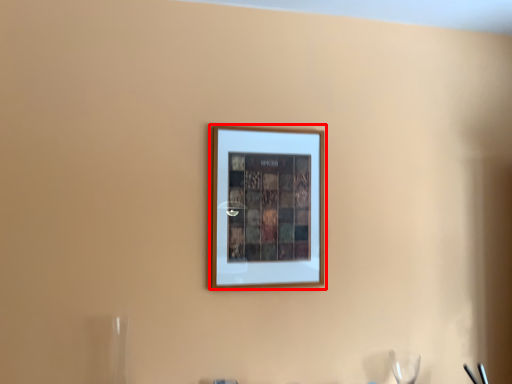
Question: From the image, what is the correct spatial relationship of picture frame (annotated by the red box) in relation to wine glass?

Choices:
 (A) right
 (B) left

Answer: (B)